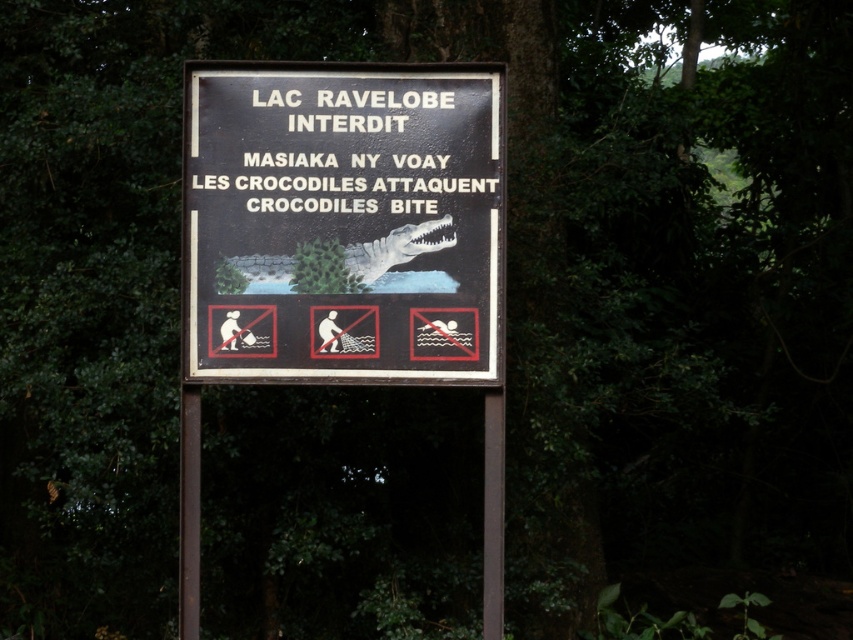
You are a hiker who needs to secure a rope between the black plastic sign at center and the metallic pole at center to hang a warning flag. Can you safely attach the rope between these two objects?

The black plastic sign at center might be wider than metallic pole at center, so the distance between them may allow the rope to be securely attached without sagging too much. However, since the exact width difference isn not specified, proceed with caution to ensure stability.

You are a hiker who just arrived at the lake and see the black plastic sign at center and the metallic pole at center. According to the sign, what should you avoid doing in the lake?

The sign warns that swimming is prohibited due to crocodiles, so you should avoid swimming in the lake.